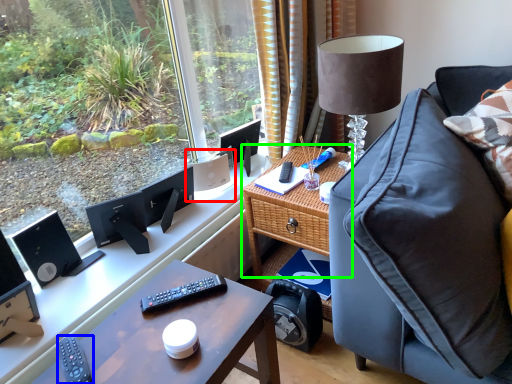
Question: Considering the real-world distances, which object is farthest from speaker (highlighted by a red box)? remote control (highlighted by a blue box) or table (highlighted by a green box)?

Choices:
 (A) remote control
 (B) table

Answer: (A)